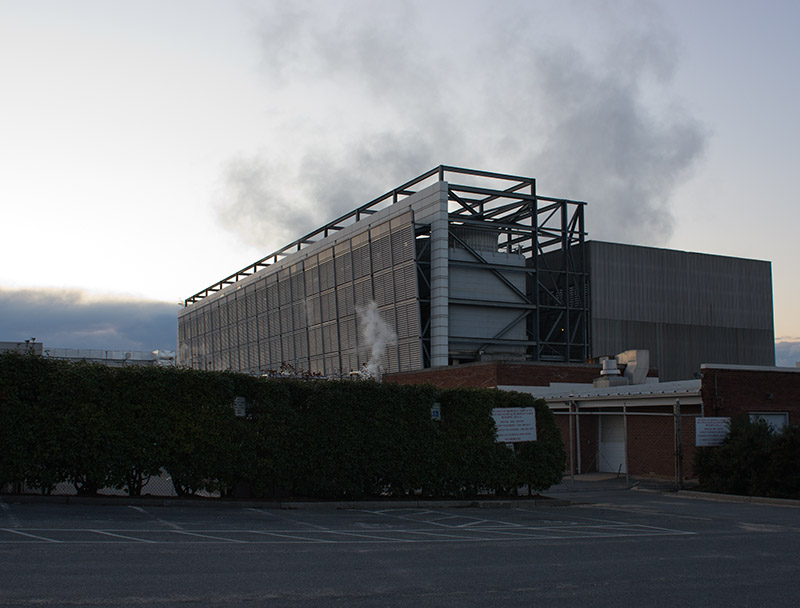
This screenshot has width=800, height=608. Find the location of `wall`. wall is located at coordinates 654,447.